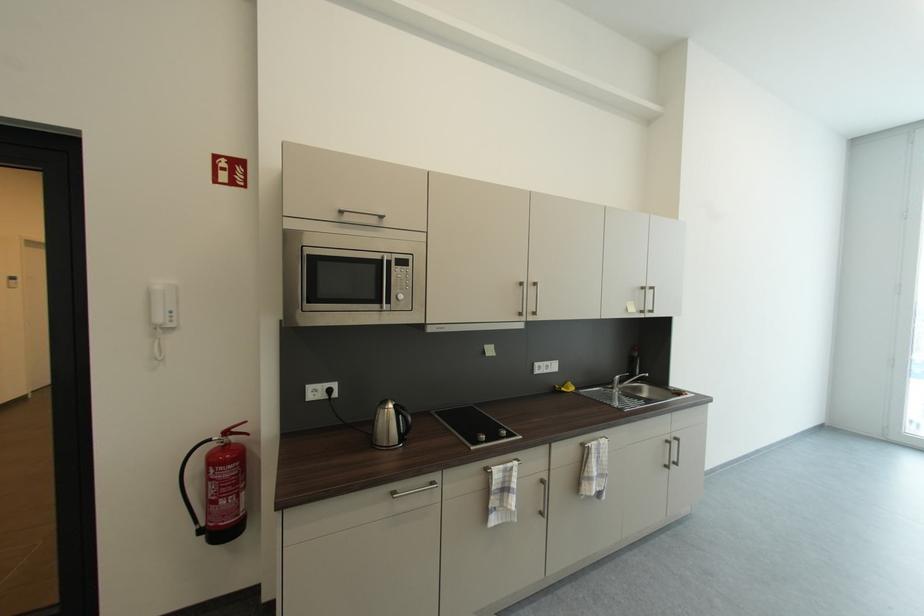
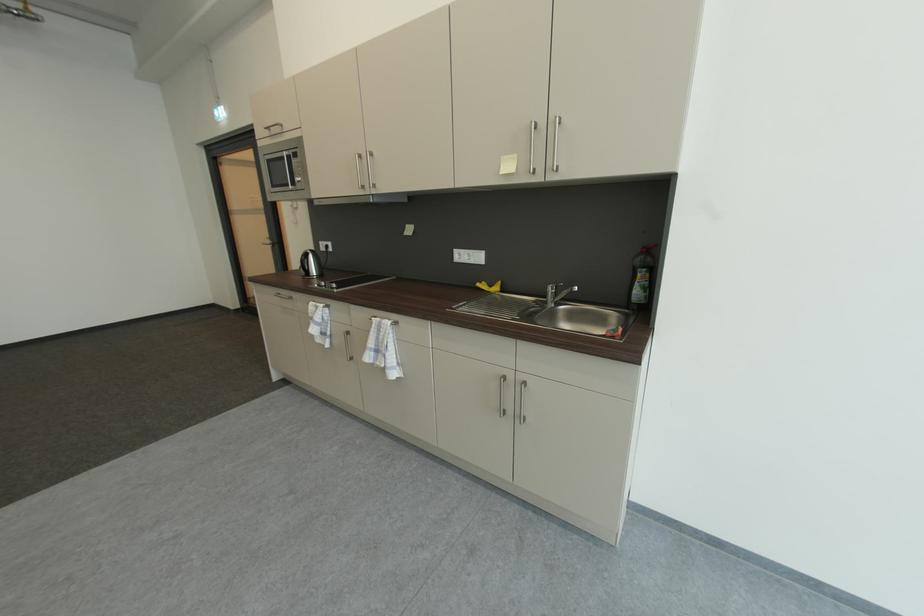
Find the pixel in the second image that matches point (642, 350) in the first image.

(650, 252)